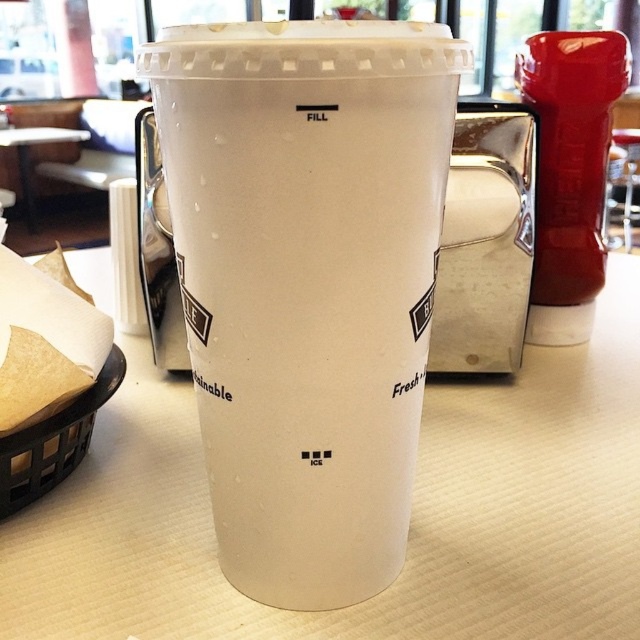
Question: Which of the following is the closest to the observer?

Choices:
 (A) (310, 536)
 (B) (134, 248)
 (C) (17, 467)
 (D) (28, 182)

Answer: (A)

Question: Does white plastic cup at center have a larger size compared to white paper towel at left?

Choices:
 (A) no
 (B) yes

Answer: (B)

Question: Considering the real-world distances, which object is closest to the white translucent cup at center?

Choices:
 (A) black woven basket at lower left
 (B) white paper towel at left

Answer: (A)

Question: Which of the following is the farthest from the observer?

Choices:
 (A) (349, 157)
 (B) (113, 240)
 (C) (84, 420)
 (D) (20, 168)

Answer: (D)

Question: Does white plastic cup at center have a greater width compared to black woven basket at lower left?

Choices:
 (A) no
 (B) yes

Answer: (B)

Question: Can you confirm if black woven basket at lower left is positioned above white paper towel at left?

Choices:
 (A) no
 (B) yes

Answer: (A)